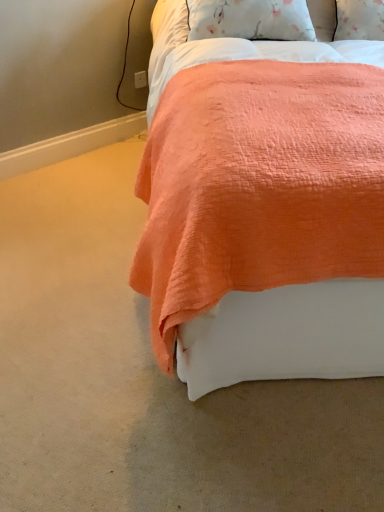
Question: Should I look upward or downward to see coral quilted bed at center?

Choices:
 (A) up
 (B) down

Answer: (A)